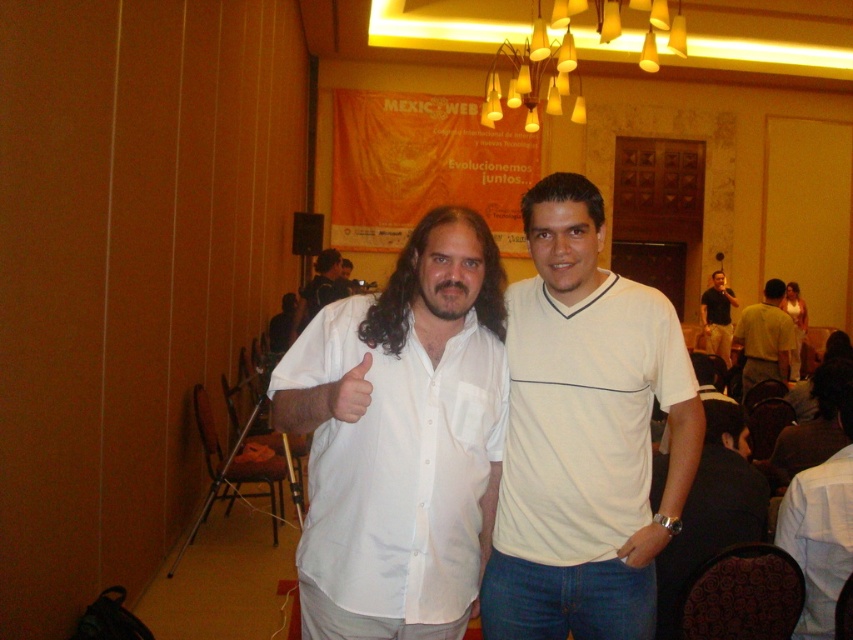
You are organizing a clothing donation drive and need to categorize shirts by their thickness. You have two shirts in front of you, the dark gray fabric shirt at lower right and the yellow cotton shirt at center. Which shirt should you place in the thicker category?

The yellow cotton shirt at center should be placed in the thicker category because the dark gray fabric shirt at lower right is thinner than it.

You are standing at point (703,456) and want to reach the large orange banner hanging on the wall in the background. The banner is 9.09 feet away from you. Can you walk straight to the banner without any obstacles?

Yes, since the distance between you and the banner is 9.09 feet and there are no objects mentioned in the scene blocking the path, you can walk straight to the banner.